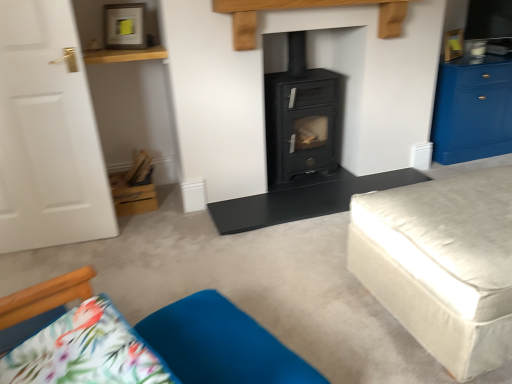
Question: Looking at their shapes, would you say beige fabric ottoman at right is wider or thinner than black matte table at center?

Choices:
 (A) wide
 (B) thin

Answer: (B)

Question: From the image's perspective, is beige fabric ottoman at right located above or below black matte table at center?

Choices:
 (A) below
 (B) above

Answer: (A)

Question: Which of these objects is positioned farthest from the velvety blue cushion at lower center?

Choices:
 (A) white matte door at left
 (B) black matte wood burning stove at center
 (C) beige fabric ottoman at right
 (D) black matte table at center
 (E) blue glossy cabinet at right

Answer: (E)

Question: Based on their relative distances, which object is nearer to the white matte door at left?

Choices:
 (A) black matte table at center
 (B) black matte wood burning stove at center
 (C) velvety blue cushion at lower center
 (D) blue glossy cabinet at right
 (E) beige fabric ottoman at right

Answer: (A)